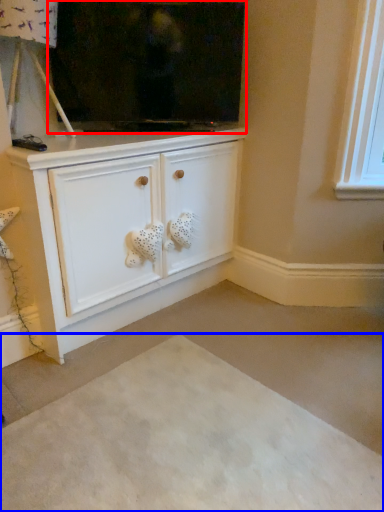
Question: Which of the following is the farthest to the observer, fireplace (highlighted by a red box) or plain (highlighted by a blue box)?

Choices:
 (A) fireplace
 (B) plain

Answer: (A)